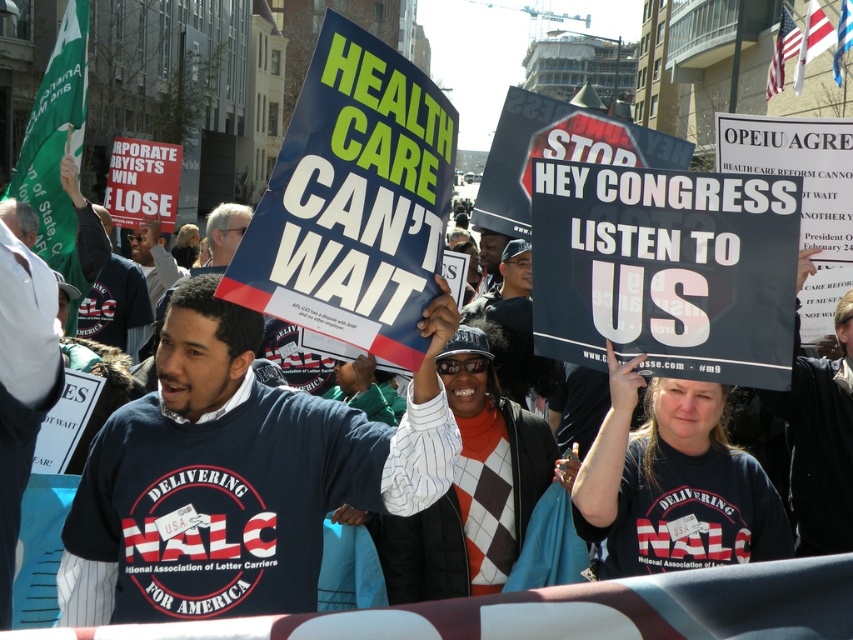
Question: Can you confirm if navy blue shirt at center is positioned below dark blue shirt at center?

Choices:
 (A) no
 (B) yes

Answer: (B)

Question: Is navy blue shirt at center positioned before dark blue shirt at center?

Choices:
 (A) no
 (B) yes

Answer: (B)

Question: Which point is farther to the camera?

Choices:
 (A) navy blue shirt at center
 (B) dark blue shirt at center

Answer: (B)

Question: Does navy blue shirt at center appear over dark blue shirt at center?

Choices:
 (A) no
 (B) yes

Answer: (A)